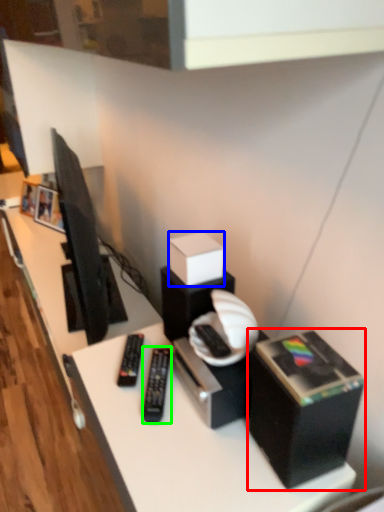
Question: Estimate the real-world distances between objects in this image. Which object is farther from box (highlighted by a red box), box (highlighted by a blue box) or equipment (highlighted by a green box)?

Choices:
 (A) box
 (B) equipment

Answer: (A)